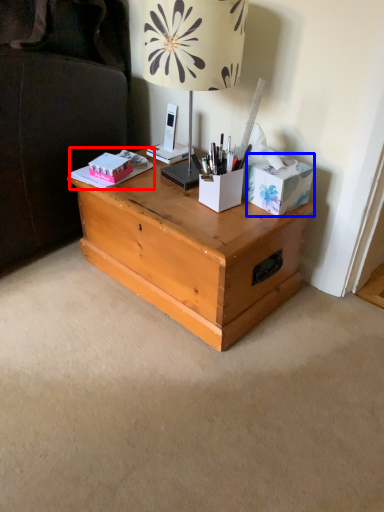
Question: Which object appears farthest to the camera in this image, book (highlighted by a red box) or cardboard box (highlighted by a blue box)?

Choices:
 (A) book
 (B) cardboard box

Answer: (A)